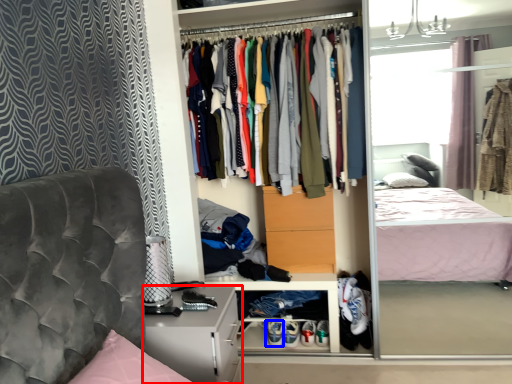
Question: Among these objects, which one is nearest to the camera, nightstand (highlighted by a red box) or footwear (highlighted by a blue box)?

Choices:
 (A) nightstand
 (B) footwear

Answer: (A)